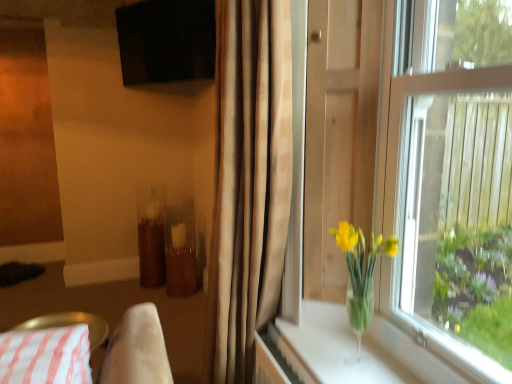
What are the coordinates of `free spot behind translucent glass vase at window` in the screenshot? It's located at (329, 337).